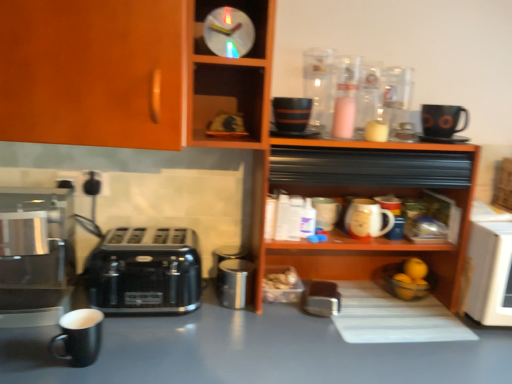
Locate an element on the screen. vacant area located to the right-hand side of black plastic toaster at lower left is located at coordinates (234, 323).